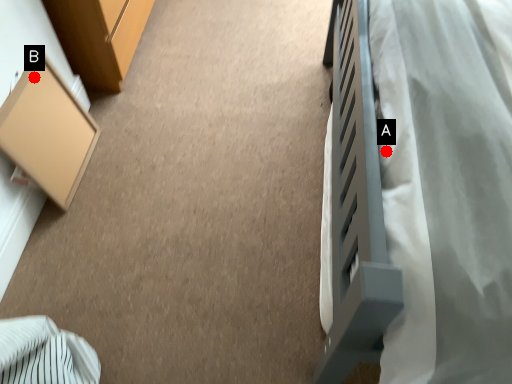
Question: Two points are circled on the image, labeled by A and B beside each circle. Which point is closer to the camera?

Choices:
 (A) A is closer
 (B) B is closer

Answer: (A)